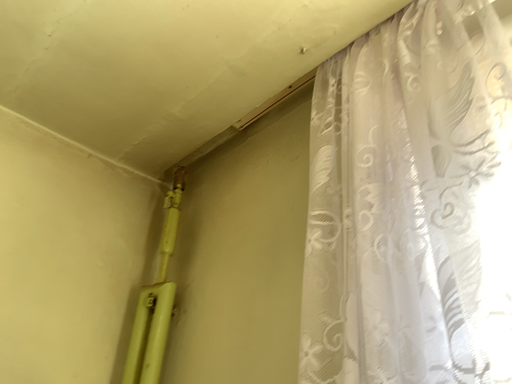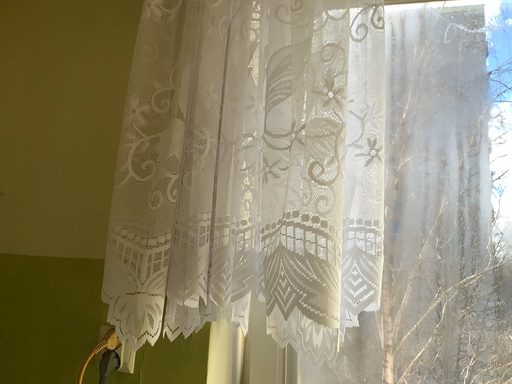
Question: How did the camera likely rotate when shooting the video?

Choices:
 (A) rotated upward
 (B) rotated downward

Answer: (B)